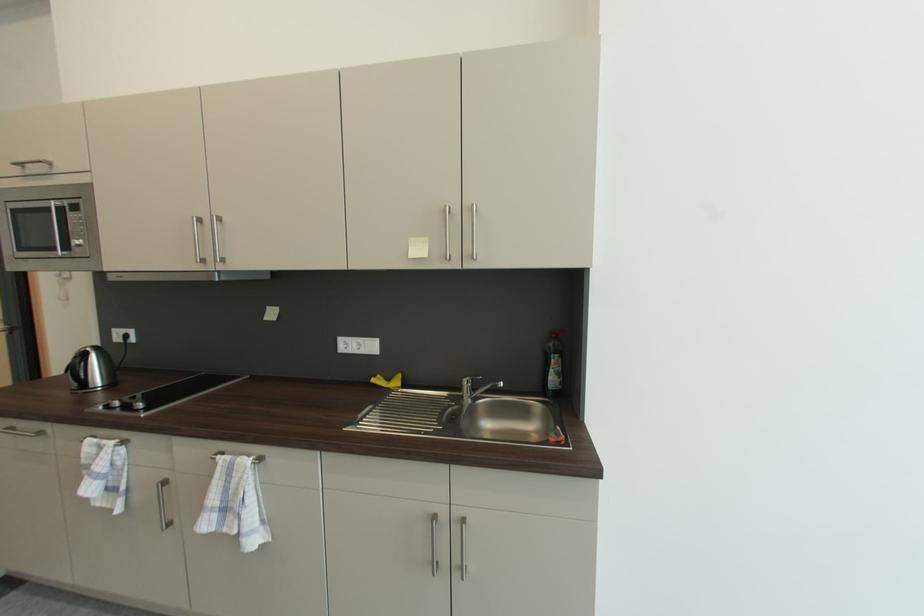
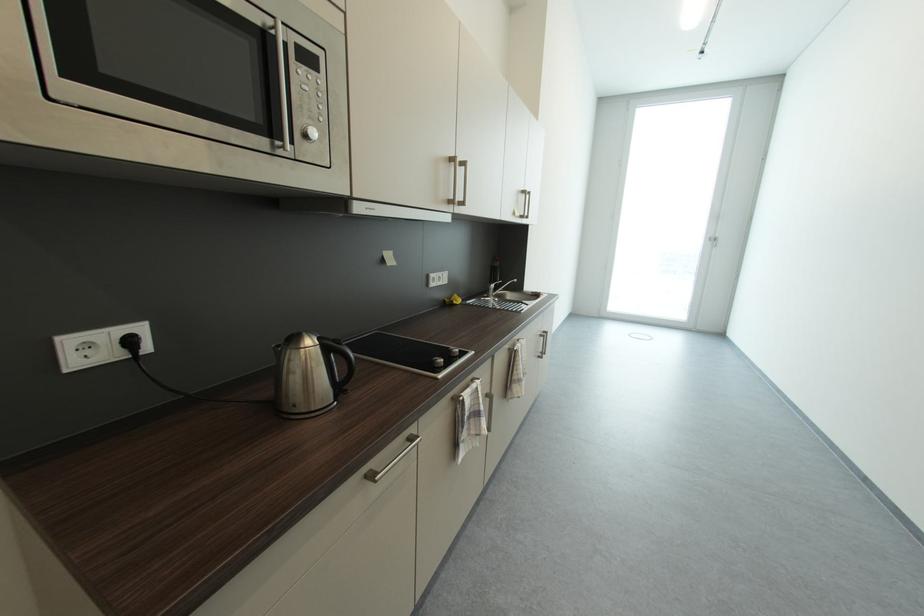
Locate, in the second image, the point that corresponds to (x=382, y=378) in the first image.

(453, 302)